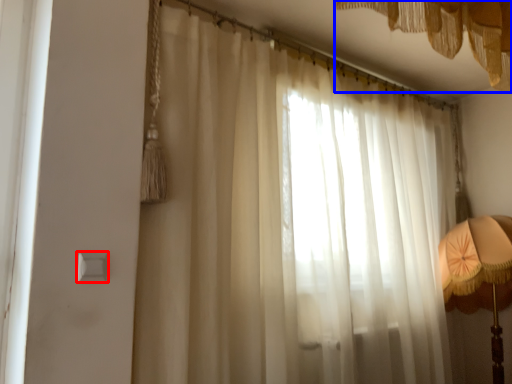
Question: Among these objects, which one is nearest to the camera, light switch (highlighted by a red box) or curtain (highlighted by a blue box)?

Choices:
 (A) light switch
 (B) curtain

Answer: (B)